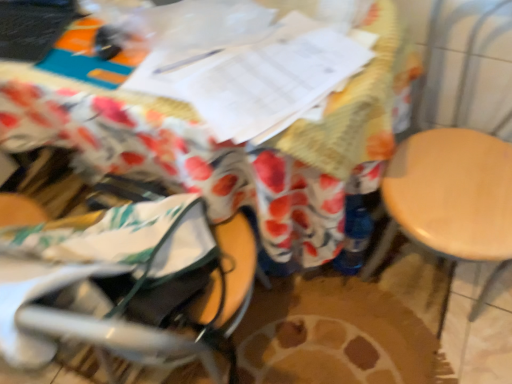
In order to face wooden table at center, should I rotate leftwards or rightwards?

You should rotate left by 9.261 degrees.

What do you see at coordinates (464, 65) in the screenshot? I see `light wood swivel chair at right` at bounding box center [464, 65].

This screenshot has width=512, height=384. Find the location of `gray fabric baby carriage at lower left`. gray fabric baby carriage at lower left is located at coordinates click(119, 275).

Is point (388, 276) in front of point (268, 240)?

No, (388, 276) is behind (268, 240).

Who is bigger, light wood swivel chair at right or wooden table at center?

With larger size is wooden table at center.

From a real-world perspective, who is located higher, light wood swivel chair at right or wooden table at center?

From a 3D spatial view, light wood swivel chair at right is above.

Which is behind, wooden table at center or gray fabric baby carriage at lower left?

wooden table at center is further away from the camera.

Can you tell me how much wooden table at center and gray fabric baby carriage at lower left differ in facing direction?

The angle between the facing direction of wooden table at center and the facing direction of gray fabric baby carriage at lower left is 173 degrees.

Is wooden table at center far away from gray fabric baby carriage at lower left?

No, wooden table at center is not far away from gray fabric baby carriage at lower left.

From the image's perspective, does wooden table at center appear lower than light wood swivel chair at right?

No, from the image's perspective, wooden table at center is not below light wood swivel chair at right.

Locate an element on the screen. This screenshot has width=512, height=384. swivel chair that is on the right side of wooden table at center is located at coordinates (464, 65).

Is wooden table at center oriented away from light wood swivel chair at right?

No, wooden table at center's orientation is not away from light wood swivel chair at right.

Is wooden table at center outside of light wood swivel chair at right?

Yes.

Looking at this image, is gray fabric baby carriage at lower left smaller than wooden table at center?

Indeed, gray fabric baby carriage at lower left has a smaller size compared to wooden table at center.

Is the surface of gray fabric baby carriage at lower left in direct contact with wooden table at center?

No, gray fabric baby carriage at lower left is not with wooden table at center.

Based on the photo, between gray fabric baby carriage at lower left and wooden table at center, which one appears on the right side from the viewer's perspective?

Positioned to the right is wooden table at center.

Considering the points (112, 301) and (264, 223), which point is behind, point (112, 301) or point (264, 223)?

Point (264, 223)

Considering the sizes of objects light wood swivel chair at right and gray fabric baby carriage at lower left in the image provided, who is taller, light wood swivel chair at right or gray fabric baby carriage at lower left?

With more height is light wood swivel chair at right.

From a real-world perspective, is light wood swivel chair at right above or below gray fabric baby carriage at lower left?

light wood swivel chair at right is situated lower than gray fabric baby carriage at lower left in the real world.

Locate an element on the screen. This screenshot has height=384, width=512. baby carriage below the light wood swivel chair at right (from the image's perspective) is located at coordinates (119, 275).

Is gray fabric baby carriage at lower left wider or thinner than light wood swivel chair at right?

Clearly, gray fabric baby carriage at lower left has less width compared to light wood swivel chair at right.

From the image's perspective, is gray fabric baby carriage at lower left on top of light wood swivel chair at right?

No.

Is gray fabric baby carriage at lower left further to camera compared to light wood swivel chair at right?

Yes.

Would you say gray fabric baby carriage at lower left is outside light wood swivel chair at right?

gray fabric baby carriage at lower left is positioned outside light wood swivel chair at right.

Where is `swivel chair below the wooden table at center (from the image's perspective)`? The height and width of the screenshot is (384, 512). swivel chair below the wooden table at center (from the image's perspective) is located at coordinates (464, 65).

Where is `baby carriage in front of the wooden table at center`? baby carriage in front of the wooden table at center is located at coordinates (119, 275).

Looking at the image, which one is located closer to wooden table at center, gray fabric baby carriage at lower left or light wood swivel chair at right?

gray fabric baby carriage at lower left is positioned closer to the anchor wooden table at center.

Considering their positions, is light wood swivel chair at right positioned further to wooden table at center than gray fabric baby carriage at lower left?

Based on the image, light wood swivel chair at right appears to be further to wooden table at center.

When comparing their distances from light wood swivel chair at right, does gray fabric baby carriage at lower left or wooden table at center seem closer?

Among the two, wooden table at center is located nearer to light wood swivel chair at right.

From the image, which object appears to be nearer to gray fabric baby carriage at lower left, wooden table at center or light wood swivel chair at right?

wooden table at center is closer to gray fabric baby carriage at lower left.

Considering their positions, is light wood swivel chair at right positioned closer to gray fabric baby carriage at lower left than wooden table at center?

wooden table at center lies closer to gray fabric baby carriage at lower left than the other object.

When comparing their distances from light wood swivel chair at right, does wooden table at center or gray fabric baby carriage at lower left seem closer?

wooden table at center is closer to light wood swivel chair at right.

In order to click on table between gray fabric baby carriage at lower left and light wood swivel chair at right from left to right in this screenshot , I will do point(231,148).